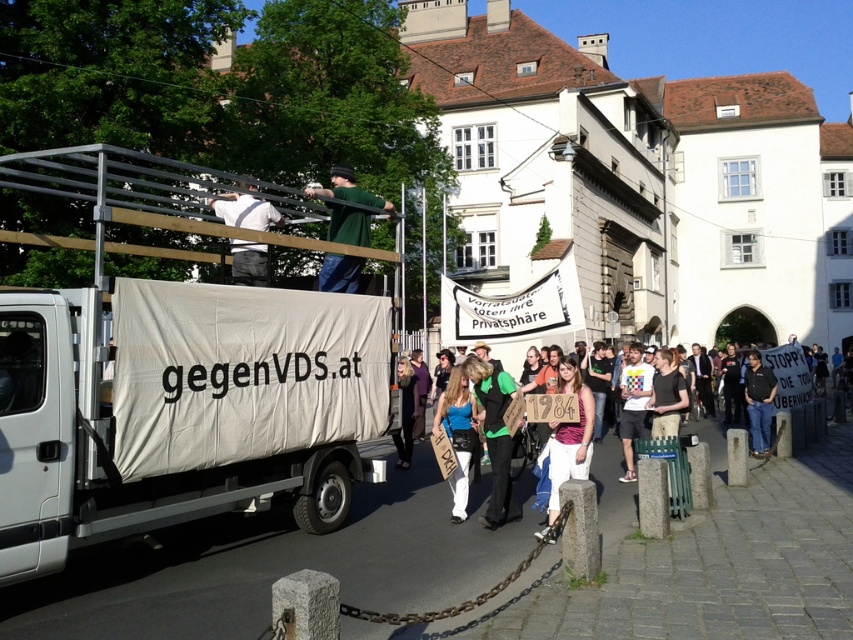
You are a photographer positioned at the edge of the pedestrian area, aiming to capture a photo of the white cotton shirt at center and the blue denim jeans at lower center. Based on their positions, which subject should you adjust your camera focus to first to ensure both are in the frame?

The blue denim jeans at lower center should be focused on first since the white cotton shirt at center is to the right of it, allowing you to adjust the frame to include both subjects.